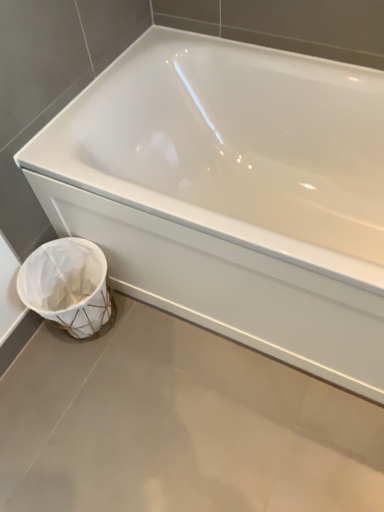
Question: From a real-world perspective, relative to white glossy bathtub at lower left, is white woven basket at lower left vertically above or below?

Choices:
 (A) above
 (B) below

Answer: (B)

Question: Relative to white glossy bathtub at lower left, is white woven basket at lower left in front or behind?

Choices:
 (A) behind
 (B) front

Answer: (A)

Question: From the image's perspective, is white woven basket at lower left located above or below white glossy bathtub at lower left?

Choices:
 (A) below
 (B) above

Answer: (A)

Question: Relative to white woven basket at lower left, is white glossy bathtub at lower left in front or behind?

Choices:
 (A) behind
 (B) front

Answer: (B)

Question: Looking at their shapes, would you say white glossy bathtub at lower left is wider or thinner than white woven basket at lower left?

Choices:
 (A) thin
 (B) wide

Answer: (B)

Question: From a real-world perspective, relative to white woven basket at lower left, is white glossy bathtub at lower left vertically above or below?

Choices:
 (A) below
 (B) above

Answer: (B)

Question: From the image's perspective, is white glossy bathtub at lower left above or below white woven basket at lower left?

Choices:
 (A) below
 (B) above

Answer: (B)